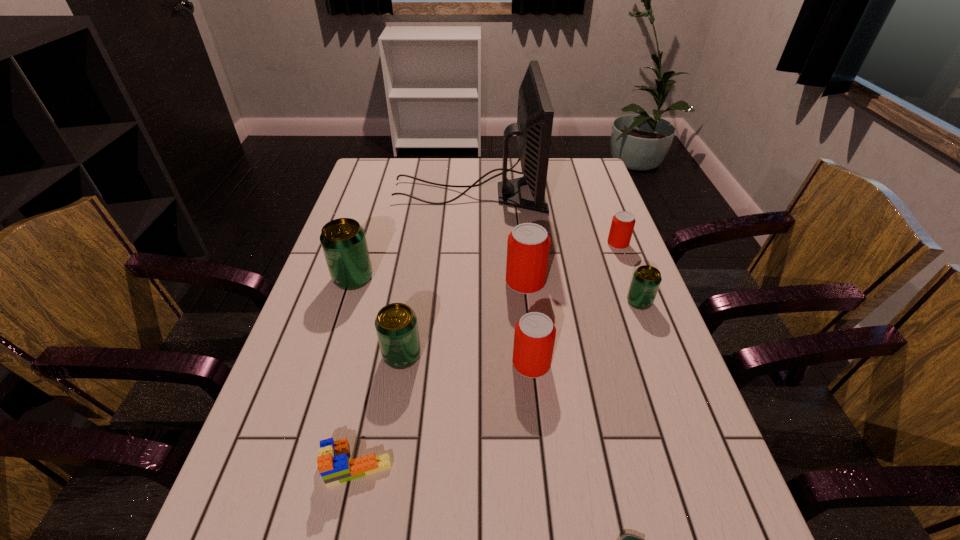
You are a GUI agent. You are given a task and a screenshot of the screen. Output one action in this format:
    pyautogui.click(x=<x>, y=<y>)
    Task: Click on the rightmost red beer can
    
    Given the screenshot: What is the action you would take?
    pyautogui.click(x=622, y=226)

I want to click on the farthest red beer can, so click(622, 226).

Find the location of `the eighth farthest object`. the eighth farthest object is located at coordinates (333, 464).

Image resolution: width=960 pixels, height=540 pixels. Find the location of `orange Lego`. orange Lego is located at coordinates (333, 464).

Find the location of a particular element. This screenshot has width=960, height=540. vacant point located 0.190m on the screen side of the tallest object is located at coordinates (600, 194).

The image size is (960, 540). Identify the location of free space located 0.280m on the front of the biggest red beer can. (538, 389).

Find the location of `free space located 0.050m on the front of the farthest green beer can`. free space located 0.050m on the front of the farthest green beer can is located at coordinates (345, 306).

The width and height of the screenshot is (960, 540). Identify the location of vacant region located 0.140m on the back of the nearest red beer can. (525, 306).

You are a GUI agent. You are given a task and a screenshot of the screen. Output one action in this format:
    pyautogui.click(x=<x>, y=<y>)
    Task: Click on the vacant space located on the back of the second smallest green beer can
    This screenshot has width=960, height=540.
    Given the screenshot: What is the action you would take?
    pyautogui.click(x=410, y=310)

Locate an element on the screen. The image size is (960, 540). free region located on the left of the rightmost green beer can is located at coordinates (584, 302).